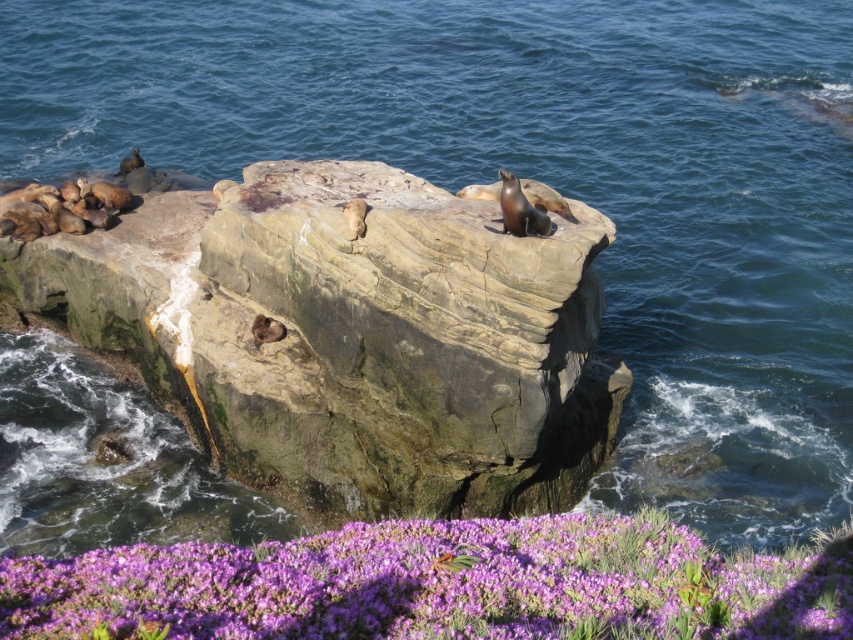
How distant is smooth rock at center from purple matte flowers at lower center?

A distance of 7.13 meters exists between smooth rock at center and purple matte flowers at lower center.

Which is in front, point (86, 301) or point (465, 588)?

Point (465, 588) is in front.

Describe the element at coordinates (349, 337) in the screenshot. This screenshot has width=853, height=640. I see `smooth rock at center` at that location.

Find the location of a particular element. smooth rock at center is located at coordinates (349, 337).